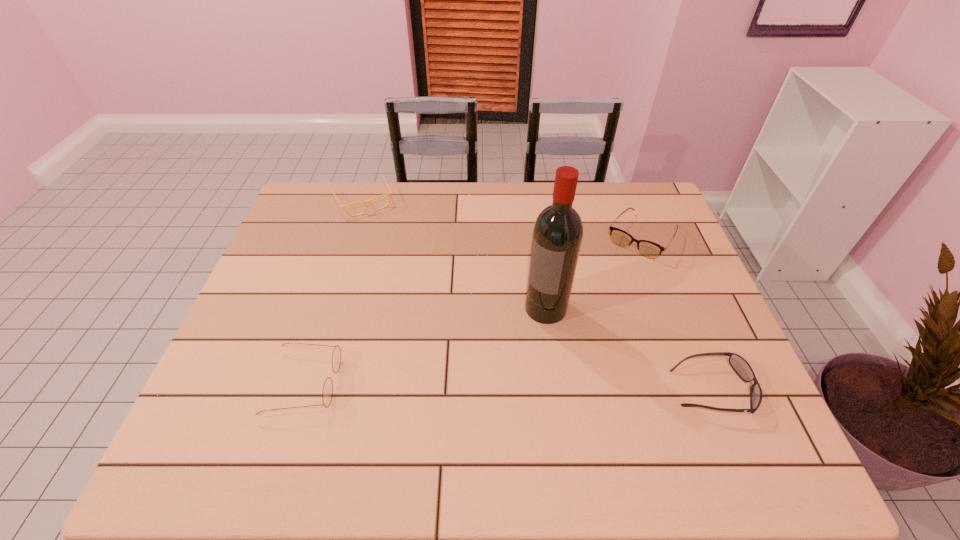
Locate an element on the screen. free space on the desktop that is between the nearest spectacles and the sunglasses and is positioned on the label of the third nearest object is located at coordinates (488, 386).

Identify the location of free space on the desktop that is between the nearest spectacles and the sunglasses and is positioned on the face of the rightmost spectacles. The height and width of the screenshot is (540, 960). (537, 387).